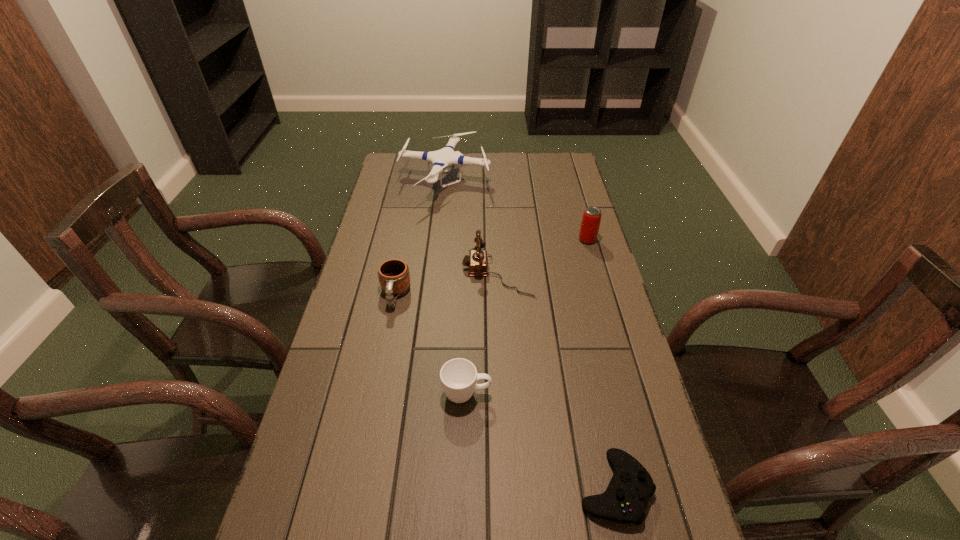
Where is `object positioned at the far left corner`? The width and height of the screenshot is (960, 540). object positioned at the far left corner is located at coordinates pos(440,159).

I want to click on vacant area at the far edge of the desktop, so click(465, 175).

This screenshot has height=540, width=960. I want to click on free space at the left edge of the desktop, so click(402, 206).

Find the location of a particular element. free region at the right edge is located at coordinates (580, 187).

What are the coordinates of `free space at the far left corner` in the screenshot? It's located at point(418,176).

Locate an element on the screen. Image resolution: width=960 pixels, height=540 pixels. vacant region at the far right corner of the desktop is located at coordinates (550, 163).

You are a GUI agent. You are given a task and a screenshot of the screen. Output one action in this format:
    pyautogui.click(x=<x>, y=<y>)
    Task: Click on the free space between the telephone and the cup
    
    Given the screenshot: What is the action you would take?
    pyautogui.click(x=482, y=333)

At what (x,y) coordinates should I click in order to perform the action: click on vacant area that lies between the control and the cup. Please return your answer as a coordinate pair (x, y). The width and height of the screenshot is (960, 540). Looking at the image, I should click on pos(540,441).

You are a GUI agent. You are given a task and a screenshot of the screen. Output one action in this format:
    pyautogui.click(x=<x>, y=<y>)
    Task: Click on the free area in between the cup and the nearest object
    This screenshot has width=960, height=540.
    Given the screenshot: What is the action you would take?
    pyautogui.click(x=540, y=441)

This screenshot has height=540, width=960. I want to click on unoccupied position between the telephone and the fifth nearest object, so click(x=542, y=256).